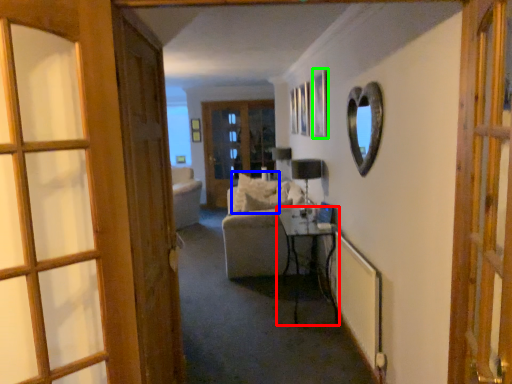
Question: Estimate the real-world distances between objects in this image. Which object is farther from table (highlighted by a red box), pillow (highlighted by a blue box) or picture frame (highlighted by a green box)?

Choices:
 (A) pillow
 (B) picture frame

Answer: (B)